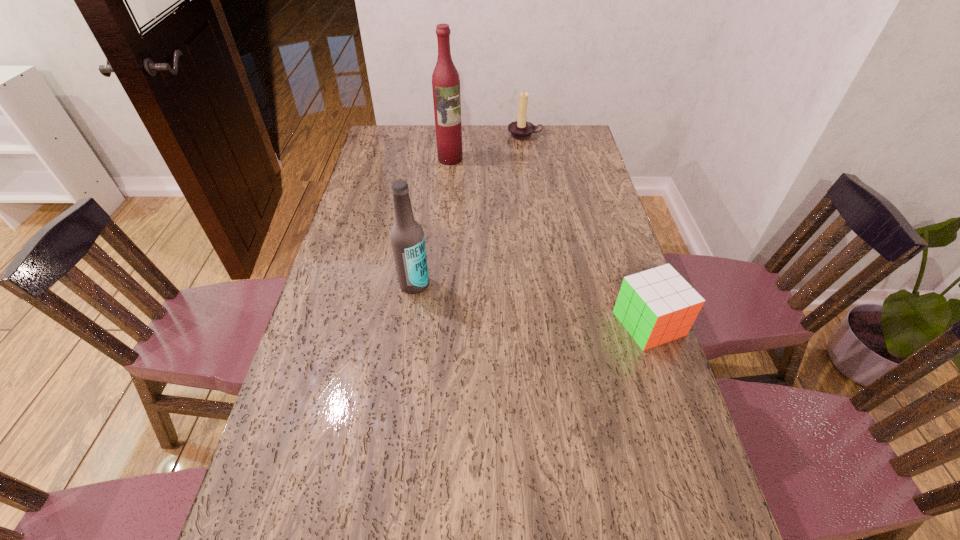
In the image, there is a desktop. Identify the location of vacant area at the left edge. The width and height of the screenshot is (960, 540). (276, 448).

Locate an element on the screen. free space at the right edge is located at coordinates (656, 476).

This screenshot has height=540, width=960. In the image, there is a desktop. In order to click on vacant space at the far left corner in this screenshot , I will do `click(407, 140)`.

The height and width of the screenshot is (540, 960). In the image, there is a desktop. Find the location of `vacant space at the near right corner`. vacant space at the near right corner is located at coordinates (624, 495).

Image resolution: width=960 pixels, height=540 pixels. In order to click on free space between the tallest object and the second nearest object in this screenshot , I will do `click(432, 221)`.

What are the coordinates of `vacant point located between the rightmost object and the third tallest object` in the screenshot? It's located at (587, 230).

Find the location of a particular element. The image size is (960, 540). free space between the third shortest object and the second farthest object is located at coordinates (432, 221).

This screenshot has height=540, width=960. I want to click on free spot between the shortest object and the third shortest object, so click(x=532, y=304).

Identify the location of unoccupied area between the second nearest object and the third nearest object. Image resolution: width=960 pixels, height=540 pixels. (432, 221).

The width and height of the screenshot is (960, 540). Identify the location of empty space between the rightmost object and the farthest object. (587, 230).